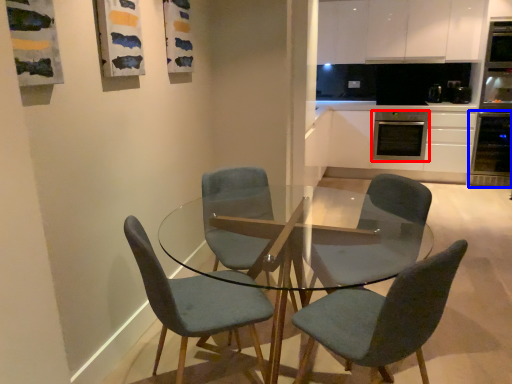
Question: Which of the following is the farthest to the observer, kitchen appliance (highlighted by a red box) or oven (highlighted by a blue box)?

Choices:
 (A) kitchen appliance
 (B) oven

Answer: (A)